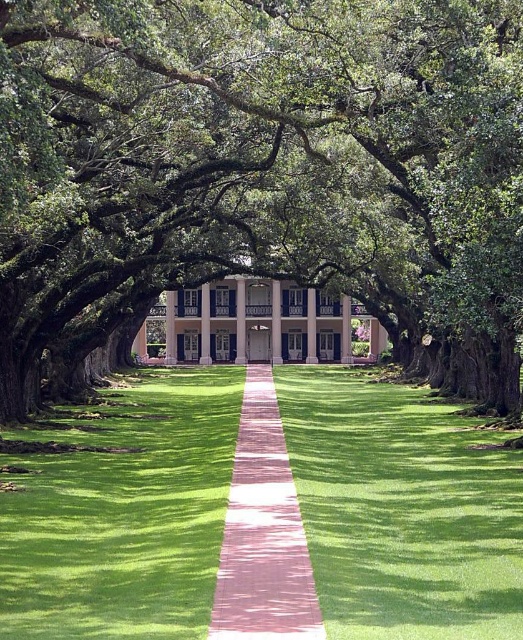
Which is below, green leafy tree at center or pink brick path at center?

pink brick path at center

Measure the distance between green leafy tree at center and camera.

green leafy tree at center and camera are 13.57 meters apart from each other.

Image resolution: width=523 pixels, height=640 pixels. Identify the location of green leafy tree at center. (265, 177).

Is green grass at center in front of pink brick path at center?

No, it is not.

Based on the photo, can you confirm if green grass at center is smaller than pink brick path at center?

No, green grass at center is not smaller than pink brick path at center.

Which is in front, point (422, 595) or point (301, 632)?

Positioned in front is point (301, 632).

Where is `green grass at center`? green grass at center is located at coordinates (403, 509).

Does green leafy tree at center lie in front of green grass at center?

No.

Which is more to the right, green leafy tree at center or green grass at center?

Positioned to the right is green leafy tree at center.

Find the location of a particular element. This screenshot has width=523, height=640. green leafy tree at center is located at coordinates (265, 177).

Where is `green leafy tree at center`? green leafy tree at center is located at coordinates (265, 177).